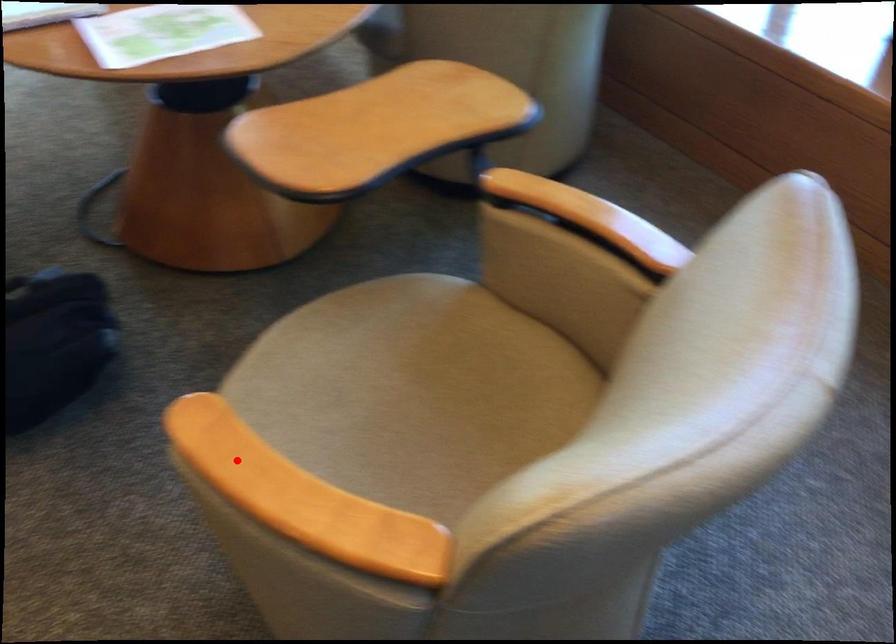
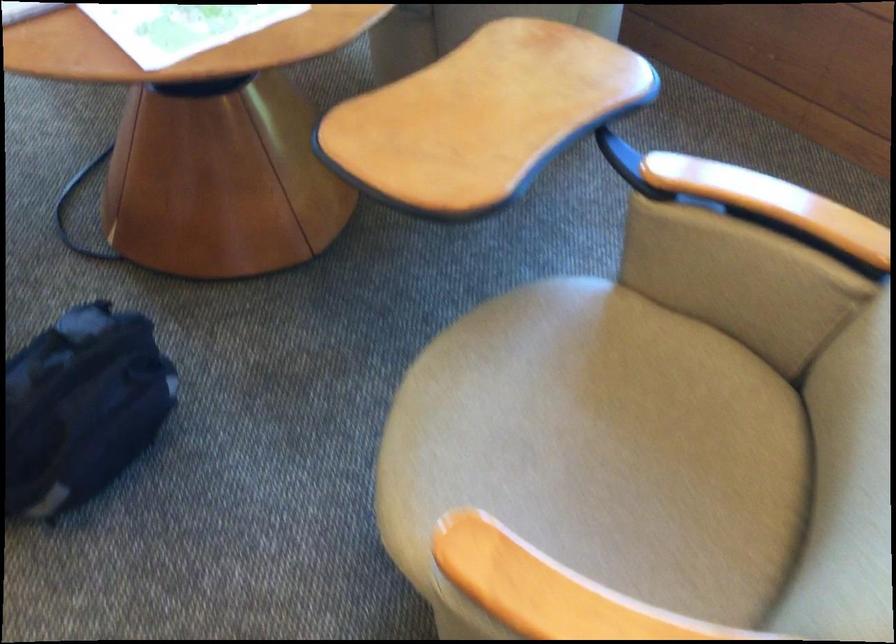
The point at the highlighted location is marked in the first image. Where is the corresponding point in the second image?

(549, 590)